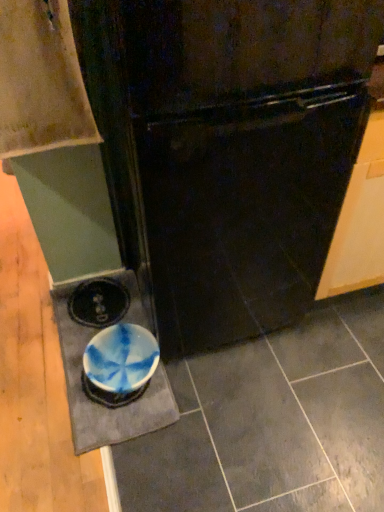
Question: Is black glossy refrigerator at center directly adjacent to wooden cabinet at upper left?

Choices:
 (A) no
 (B) yes

Answer: (A)

Question: Is the depth of black glossy refrigerator at center less than that of wooden cabinet at upper left?

Choices:
 (A) yes
 (B) no

Answer: (A)

Question: Can you confirm if black glossy refrigerator at center is smaller than wooden cabinet at upper left?

Choices:
 (A) yes
 (B) no

Answer: (B)

Question: Is black glossy refrigerator at center taller than wooden cabinet at upper left?

Choices:
 (A) no
 (B) yes

Answer: (B)

Question: From a real-world perspective, is black glossy refrigerator at center located higher than wooden cabinet at upper left?

Choices:
 (A) yes
 (B) no

Answer: (B)

Question: Considering the relative positions of black glossy refrigerator at center and wooden cabinet at upper left in the image provided, is black glossy refrigerator at center to the right of wooden cabinet at upper left from the viewer's perspective?

Choices:
 (A) yes
 (B) no

Answer: (A)

Question: Is wooden cabinet at upper left facing towards black glossy refrigerator at center?

Choices:
 (A) no
 (B) yes

Answer: (A)

Question: Is wooden cabinet at upper left next to black glossy refrigerator at center and touching it?

Choices:
 (A) yes
 (B) no

Answer: (B)

Question: From a real-world perspective, is wooden cabinet at upper left physically above black glossy refrigerator at center?

Choices:
 (A) yes
 (B) no

Answer: (A)

Question: Is wooden cabinet at upper left turned away from black glossy refrigerator at center?

Choices:
 (A) no
 (B) yes

Answer: (A)

Question: Is wooden cabinet at upper left completely or partially outside of black glossy refrigerator at center?

Choices:
 (A) yes
 (B) no

Answer: (A)

Question: Considering the relative positions of wooden cabinet at upper left and black glossy refrigerator at center in the image provided, is wooden cabinet at upper left behind black glossy refrigerator at center?

Choices:
 (A) yes
 (B) no

Answer: (A)

Question: From the image's perspective, is wooden cabinet at upper left located above or below black glossy refrigerator at center?

Choices:
 (A) above
 (B) below

Answer: (A)